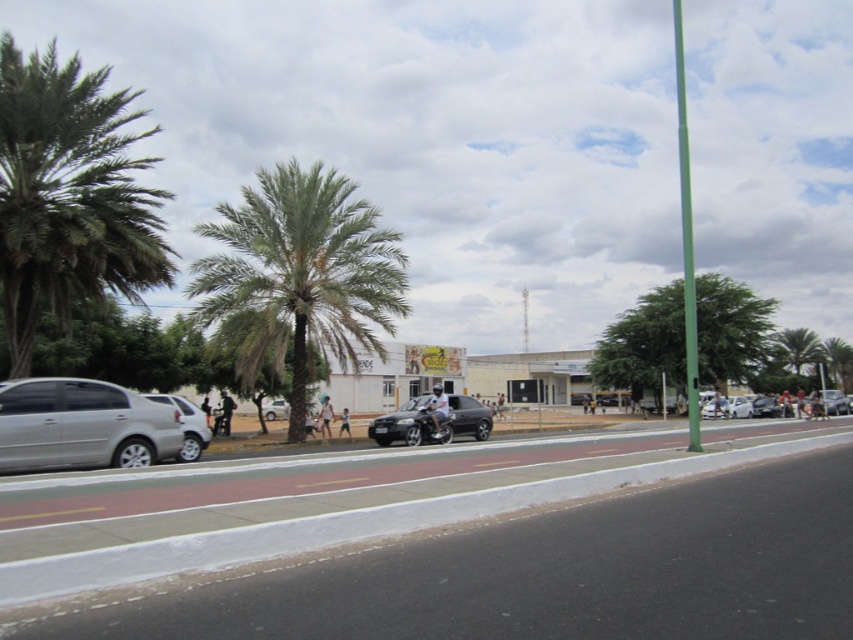
Question: Is satin silver sedan at left below satin black car at center?

Choices:
 (A) yes
 (B) no

Answer: (B)

Question: In this image, where is white concrete curb at lower left located relative to green leafy palm tree at center?

Choices:
 (A) below
 (B) above

Answer: (A)

Question: Is satin black car at center positioned behind green leafy palm tree at right?

Choices:
 (A) no
 (B) yes

Answer: (A)

Question: Which point is farther from the camera taking this photo?

Choices:
 (A) (840, 408)
 (B) (848, 388)
 (C) (6, 468)
 (D) (769, 400)

Answer: (B)

Question: Which of the following is the farthest from the observer?

Choices:
 (A) silver metallic car at center
 (B) white glossy car at center
 (C) shiny silver sedan at right

Answer: (A)

Question: Which point appears closest to the camera in this image?

Choices:
 (A) (393, 412)
 (B) (740, 413)
 (C) (782, 410)
 (D) (178, 416)

Answer: (D)